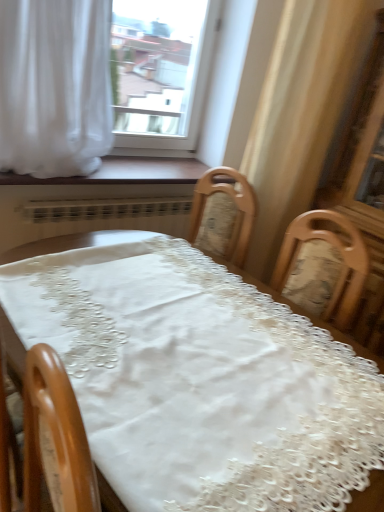
Question: Does point (119, 443) appear closer or farther from the camera than point (122, 158)?

Choices:
 (A) farther
 (B) closer

Answer: (B)

Question: Based on their sizes in the image, would you say white lace tablecloth at center is bigger or smaller than wooden at lower center?

Choices:
 (A) small
 (B) big

Answer: (B)

Question: Estimate the real-world distances between objects in this image. Which object is closer to the white sheer curtain at upper left?

Choices:
 (A) transparent glass window at upper center
 (B) white lace tablecloth at center
 (C) wooden at lower center

Answer: (C)

Question: Which is farther from the white lace tablecloth at center?

Choices:
 (A) white sheer curtain at upper left
 (B) transparent glass window at upper center
 (C) wooden at lower center

Answer: (B)